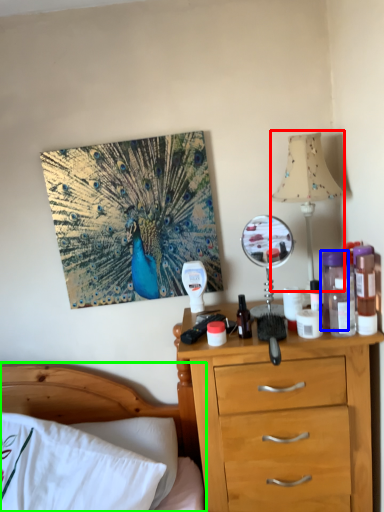
Question: Based on their relative distances, which object is farther from table lamp (highlighted by a red box)? Choose from bottle (highlighted by a blue box) and bed (highlighted by a green box).

Choices:
 (A) bottle
 (B) bed

Answer: (B)